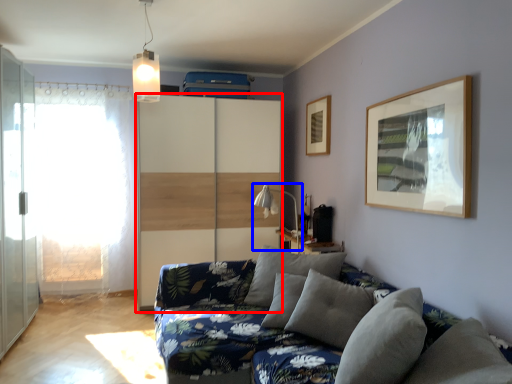
Question: Which of the following is the closest to the observer, dresser (highlighted by a red box) or table lamp (highlighted by a blue box)?

Choices:
 (A) dresser
 (B) table lamp

Answer: (B)